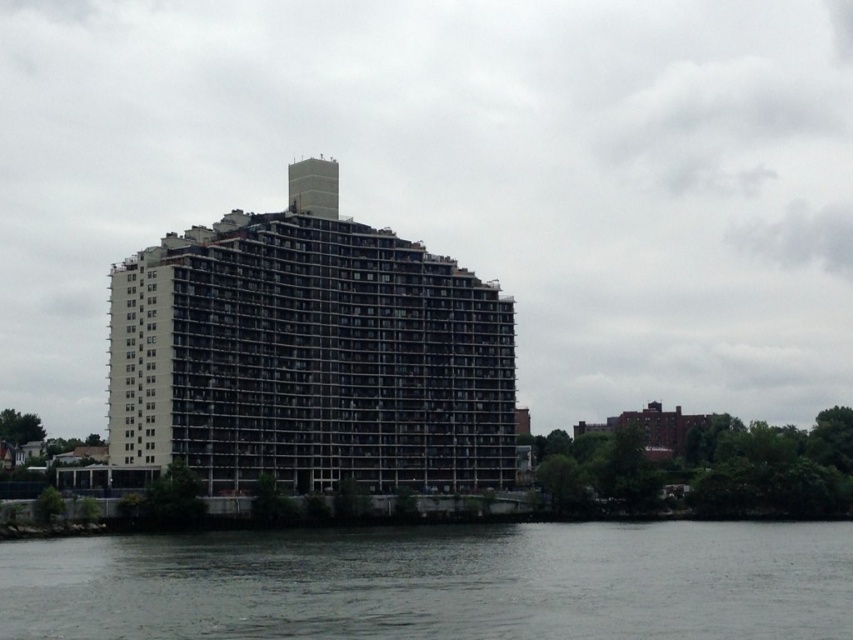
Question: Does gray concrete building at center appear on the right side of gray water at lower center?

Choices:
 (A) yes
 (B) no

Answer: (B)

Question: Which point is farther to the camera?

Choices:
 (A) gray concrete building at center
 (B) gray water at lower center

Answer: (A)

Question: Is gray concrete building at center to the right of gray water at lower center from the viewer's perspective?

Choices:
 (A) no
 (B) yes

Answer: (A)

Question: Which of the following is the closest to the observer?

Choices:
 (A) gray concrete building at center
 (B) gray water at lower center

Answer: (B)

Question: Observing the image, what is the correct spatial positioning of gray concrete building at center in reference to gray water at lower center?

Choices:
 (A) above
 (B) below

Answer: (A)